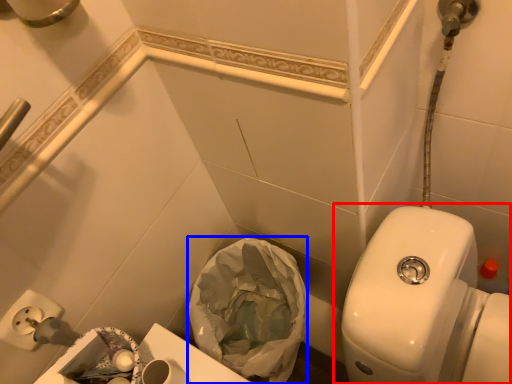
Question: Among these objects, which one is nearest to the camera, toilet (highlighted by a red box) or garbage (highlighted by a blue box)?

Choices:
 (A) toilet
 (B) garbage

Answer: (A)